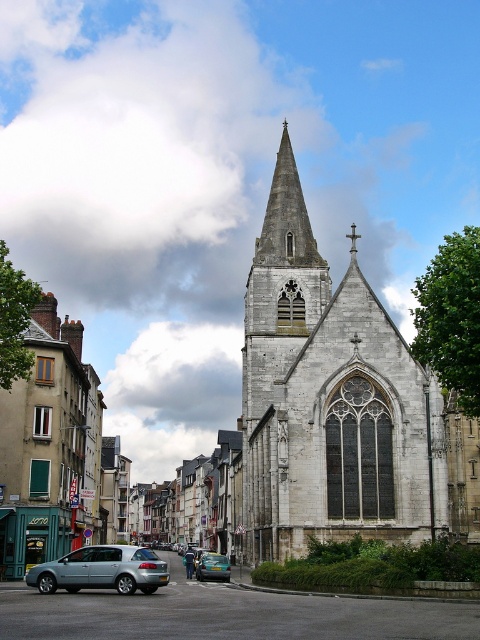
Who is positioned more to the right, light blue metallic hatchback at lower left or metallic blue sedan at center?

metallic blue sedan at center is more to the right.

What do you see at coordinates (101, 570) in the screenshot?
I see `light blue metallic hatchback at lower left` at bounding box center [101, 570].

This screenshot has width=480, height=640. Identify the location of light blue metallic hatchback at lower left. (101, 570).

Is stone church at center smaller than light blue metallic hatchback at lower left?

Incorrect, stone church at center is not smaller in size than light blue metallic hatchback at lower left.

Is stone church at center to the left of light blue metallic hatchback at lower left from the viewer's perspective?

In fact, stone church at center is to the right of light blue metallic hatchback at lower left.

Describe the element at coordinates (248, 426) in the screenshot. Image resolution: width=480 pixels, height=640 pixels. I see `stone church at center` at that location.

You are a GUI agent. You are given a task and a screenshot of the screen. Output one action in this format:
    pyautogui.click(x=<x>, y=<y>)
    Task: Click on the stone church at center
    The width and height of the screenshot is (480, 640).
    Given the screenshot: What is the action you would take?
    pyautogui.click(x=248, y=426)

Does gray stone church at center appear on the left side of light blue metallic hatchback at lower left?

No, gray stone church at center is not to the left of light blue metallic hatchback at lower left.

Who is higher up, gray stone church at center or light blue metallic hatchback at lower left?

gray stone church at center is higher up.

Does point (271, 484) come behind point (46, 580)?

That is True.

Identify the location of gray stone church at center. This screenshot has height=640, width=480. [338, 404].